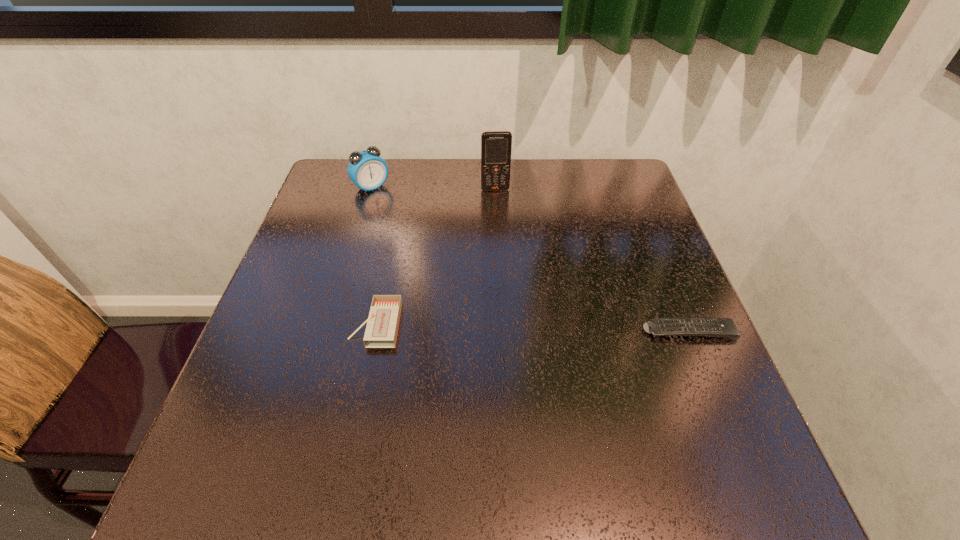
You are a GUI agent. You are given a task and a screenshot of the screen. Output one action in this format:
    pyautogui.click(x=<x>, y=<y>)
    Task: Click on the vacant space located 0.110m on the screen of the second object from right to left
    The image size is (960, 540).
    Given the screenshot: What is the action you would take?
    pyautogui.click(x=499, y=217)

Identify the location of vacant space located on the screen of the second object from right to left. coord(508,289).

Locate an element on the screen. Image resolution: width=960 pixels, height=540 pixels. free spot located on the screen of the second object from right to left is located at coordinates (498, 210).

You are a GUI agent. You are given a task and a screenshot of the screen. Output one action in this format:
    pyautogui.click(x=<x>, y=<y>)
    Task: Click on the free space located 0.320m on the face of the second tallest object
    
    Given the screenshot: What is the action you would take?
    pyautogui.click(x=442, y=260)

Locate an element on the screen. Image resolution: width=960 pixels, height=540 pixels. vacant position located 0.300m on the face of the second tallest object is located at coordinates (437, 255).

The width and height of the screenshot is (960, 540). I want to click on vacant space situated on the face of the second tallest object, so click(x=392, y=207).

Locate an element on the screen. cellular telephone positioned at the far edge is located at coordinates (496, 146).

This screenshot has width=960, height=540. In order to click on alarm clock located in the far edge section of the desktop in this screenshot , I will do `click(368, 171)`.

Where is `object situated at the left edge`? This screenshot has height=540, width=960. object situated at the left edge is located at coordinates (368, 171).

What are the coordinates of `object at the right edge` in the screenshot? It's located at (722, 327).